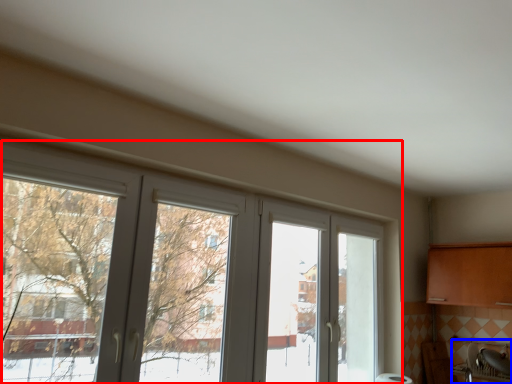
Question: Which object appears farthest to the camera in this image, window (highlighted by a red box) or sink (highlighted by a blue box)?

Choices:
 (A) window
 (B) sink

Answer: (B)